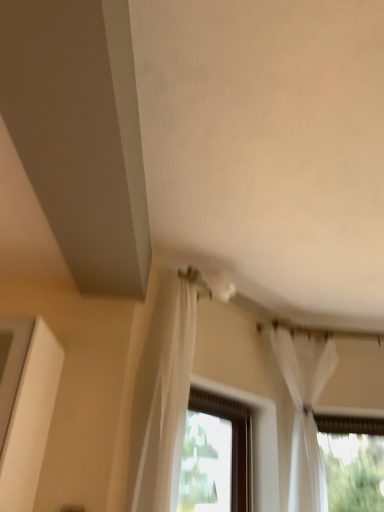
Question: From the image's perspective, is brown wooden window at center located above or below white sheer curtain at upper right?

Choices:
 (A) below
 (B) above

Answer: (A)

Question: In terms of width, does brown wooden window at center look wider or thinner when compared to white sheer curtain at upper right?

Choices:
 (A) thin
 (B) wide

Answer: (A)

Question: Considering the positions of point (200, 434) and point (311, 415), is point (200, 434) closer or farther from the camera than point (311, 415)?

Choices:
 (A) farther
 (B) closer

Answer: (A)

Question: From the image's perspective, is white sheer curtain at upper right above or below brown wooden window at center?

Choices:
 (A) below
 (B) above

Answer: (B)

Question: From a real-world perspective, is white sheer curtain at upper right positioned above or below brown wooden window at center?

Choices:
 (A) below
 (B) above

Answer: (B)

Question: Based on their positions, is white sheer curtain at upper right located to the left or right of brown wooden window at center?

Choices:
 (A) right
 (B) left

Answer: (A)

Question: In terms of height, does white sheer curtain at upper right look taller or shorter compared to brown wooden window at center?

Choices:
 (A) tall
 (B) short

Answer: (A)